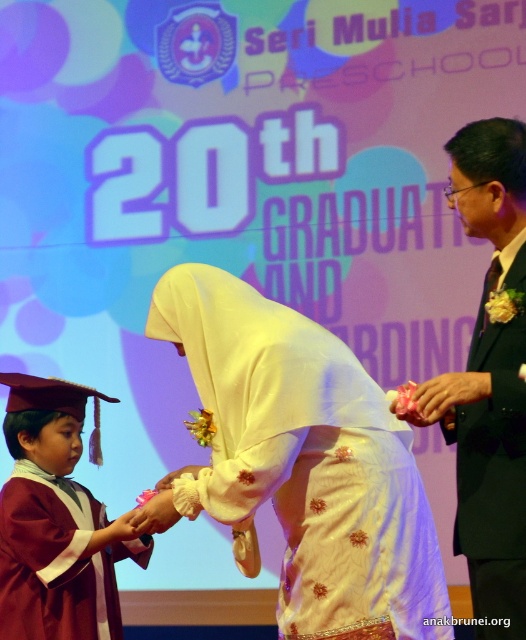
Can you confirm if white satin dress at center is positioned to the right of black suit at right?

Result: Incorrect, white satin dress at center is not on the right side of black suit at right.

Does white satin dress at center have a lesser width compared to black suit at right?

No, white satin dress at center is not thinner than black suit at right.

You are a GUI agent. You are given a task and a screenshot of the screen. Output one action in this format:
    pyautogui.click(x=<x>, y=<y>)
    Task: Click on the white satin dress at center
    
    Given the screenshot: What is the action you would take?
    pyautogui.click(x=302, y=464)

Which is more to the left, white satin dress at center or maroon satin graduation gown at lower left?

maroon satin graduation gown at lower left

Find the location of a particular element. white satin dress at center is located at coordinates (302, 464).

Does point (491, 368) come behind point (46, 394)?

That is False.

Who is positioned more to the right, black suit at right or maroon satin graduation gown at lower left?

black suit at right is more to the right.

Which is in front, point (520, 252) or point (16, 392)?

Positioned in front is point (520, 252).

Locate an element on the screen. black suit at right is located at coordinates (488, 380).